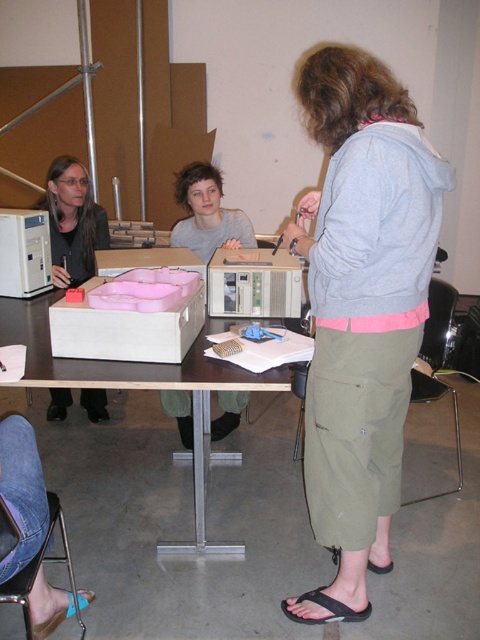
You are a technician trying to set up a video call between the matte black laptop at left and the camera. The minimum required distance for the connection to work is 10 feet. Can the connection be established?

The matte black laptop at left and camera are 8.73 feet apart from each other, which is less than the required 10 feet. Therefore, the connection cannot be established.

You are standing in the workshop and want to place a small object on the table. You have two points to choose from, point [370,612] and point [91,593]. Which point is closer to you?

Point [370,612] is closer to the camera than point [91,593], so you should place the object on point [370,612] as it is closer to you.

You are a student in the classroom and need to locate the matte black laptop at left. According to the coordinates provided, where exactly should you look to find it?

The matte black laptop at left is located at the coordinates point (72,221).